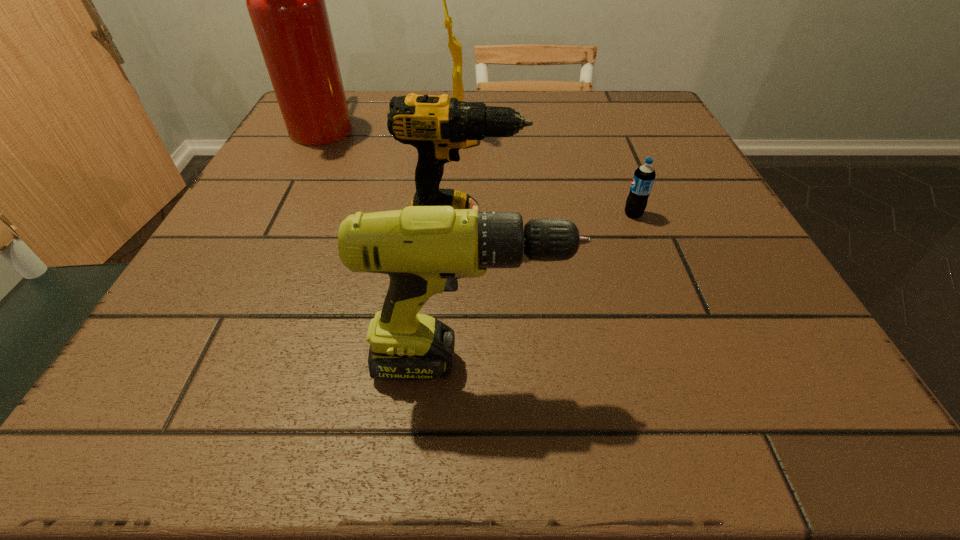
Locate which object is the second closest to the soda bottle. Please provide its 2D coordinates. Your answer should be formatted as a tuple, i.e. [(x, y)], where the tuple contains the x and y coordinates of a point satisfying the conditions above.

[(424, 249)]

The image size is (960, 540). What are the coordinates of `free location that satisfies the following two spatial constraints: 1. with the handle and nozzle on the rightmost object; 2. on the left side of the fire extinguisher` in the screenshot? It's located at (277, 214).

Locate an element on the screen. This screenshot has width=960, height=540. vacant region that satisfies the following two spatial constraints: 1. with the handle and nozzle on the fire extinguisher; 2. on the right side of the soda bottle is located at coordinates (277, 214).

Image resolution: width=960 pixels, height=540 pixels. Find the location of `vacant region that satisfies the following two spatial constraints: 1. with the handle and nozzle on the rightmost object; 2. on the right side of the leftmost object`. vacant region that satisfies the following two spatial constraints: 1. with the handle and nozzle on the rightmost object; 2. on the right side of the leftmost object is located at coordinates (277, 214).